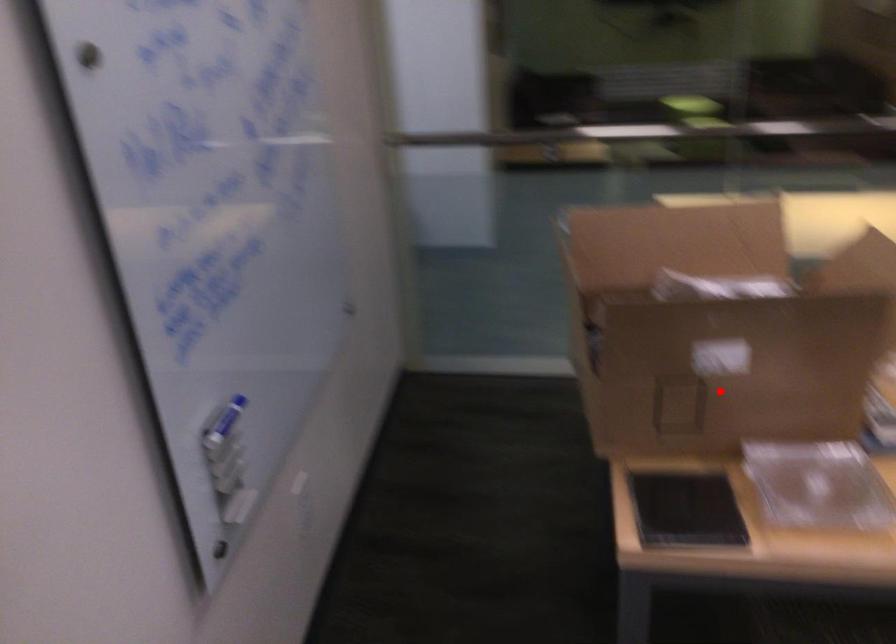
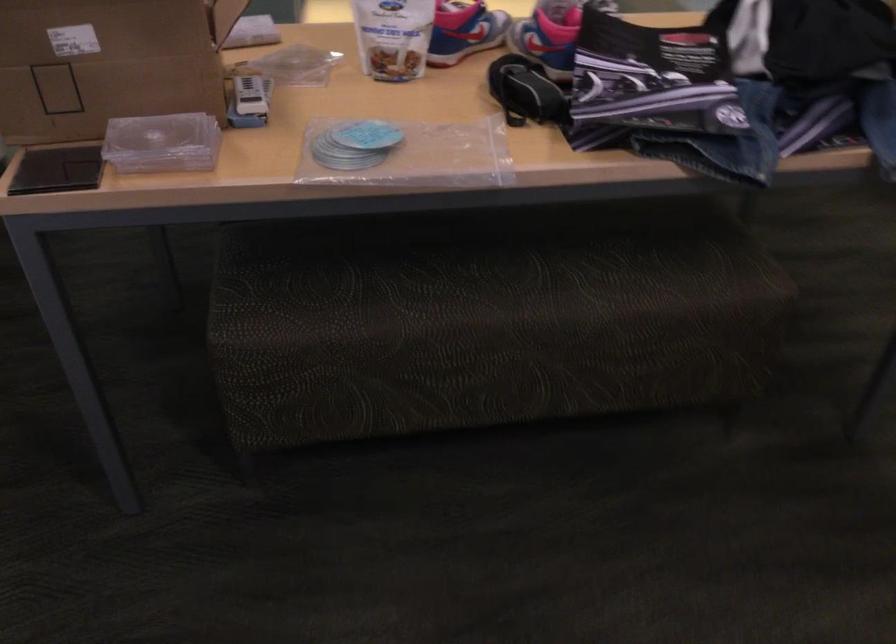
Question: I am providing you with two images of the same scene from different viewpoints. In image1, a red point is highlighted. Considering the same 3D point in image2, which of the following is correct?

Choices:
 (A) It is closer
 (B) It is farther

Answer: (B)